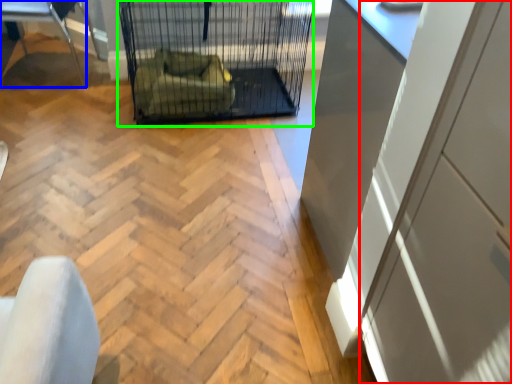
Question: Which is nearer to the screen door (highlighted by a red box)? furniture (highlighted by a blue box) or bird cage (highlighted by a green box).

Choices:
 (A) furniture
 (B) bird cage

Answer: (B)